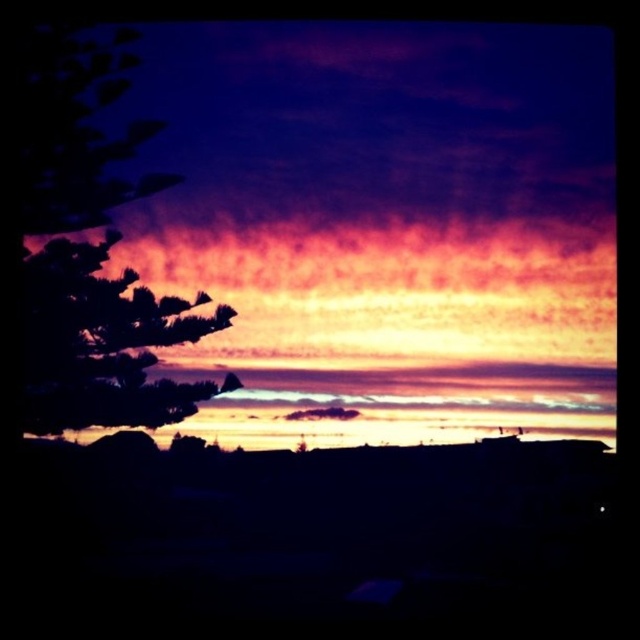
Question: Which point is closer to the camera taking this photo?

Choices:
 (A) 257,323
 (B) 122,92
 (C) 177,337

Answer: (C)

Question: Which object appears farthest from the camera in this image?

Choices:
 (A) purple matte cloud at upper center
 (B) dark purple leafy tree at left

Answer: (B)

Question: Is purple matte cloud at upper center thinner than silhouette leafy tree at left?

Choices:
 (A) yes
 (B) no

Answer: (B)

Question: Can you confirm if purple matte cloud at upper center is positioned to the left of silhouette leafy tree at left?

Choices:
 (A) no
 (B) yes

Answer: (A)

Question: Observing the image, what is the correct spatial positioning of dark purple leafy tree at left in reference to silhouette leafy tree at left?

Choices:
 (A) left
 (B) right

Answer: (A)

Question: Among these points, which one is nearest to the camera?

Choices:
 (A) (72, 390)
 (B) (513, 84)
 (C) (58, 115)

Answer: (A)